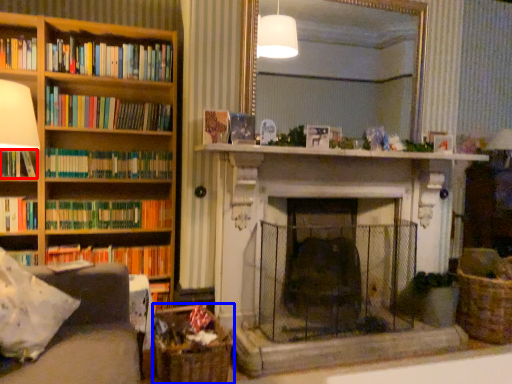
Question: Which object is further to the camera taking this photo, book (highlighted by a red box) or basket (highlighted by a blue box)?

Choices:
 (A) book
 (B) basket

Answer: (A)